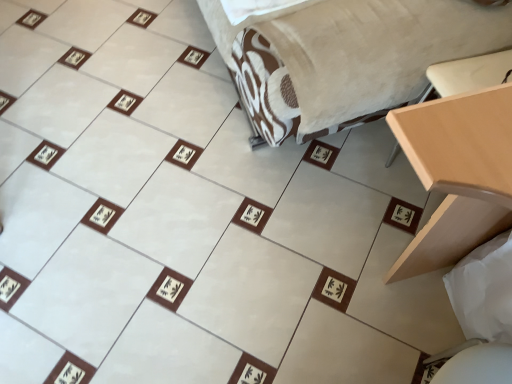
I want to click on free space to the left of white fabric sheet at lower right, so click(408, 321).